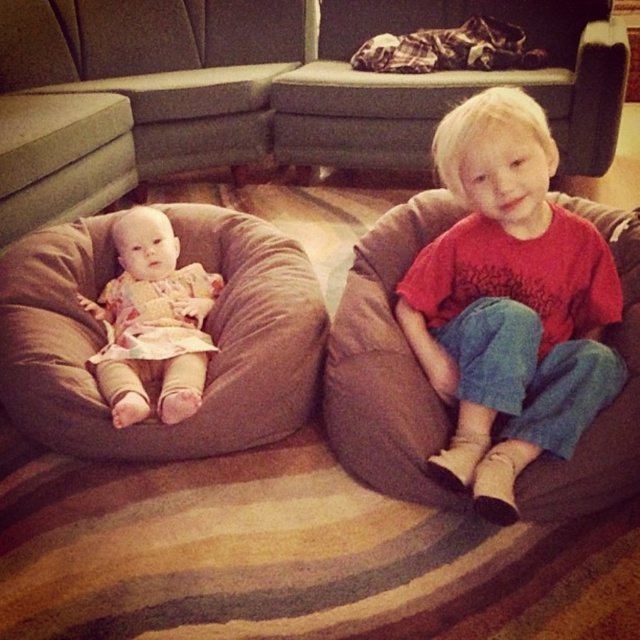
Question: Is brown fabric couch at center wider than matte red shirt at center?

Choices:
 (A) yes
 (B) no

Answer: (A)

Question: Is matte red shirt at center to the left of brown soft bean bag chair at left from the viewer's perspective?

Choices:
 (A) no
 (B) yes

Answer: (A)

Question: Is the position of brown fabric couch at center less distant than that of blonde hair boy at center?

Choices:
 (A) no
 (B) yes

Answer: (B)

Question: Which point is farther to the camera?

Choices:
 (A) matte red shirt at center
 (B) brown soft bean bag chair at left
 (C) blonde hair boy at center

Answer: (C)

Question: Among these objects, which one is nearest to the camera?

Choices:
 (A) brown soft bean bag chair at left
 (B) blonde hair boy at center
 (C) brown fabric couch at center

Answer: (A)

Question: Among these objects, which one is farthest from the camera?

Choices:
 (A) matte red shirt at center
 (B) brown soft bean bag chair at left
 (C) floral fabric baby doll at left

Answer: (B)